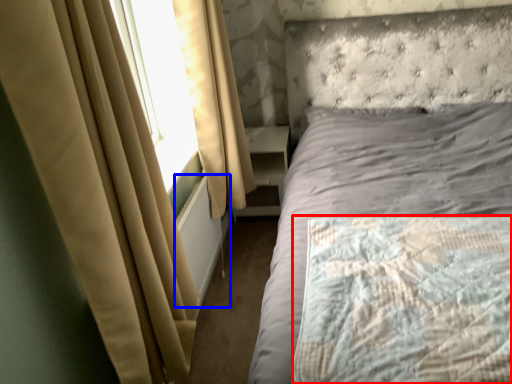
Question: Which of the following is the farthest to the observer, mattress (highlighted by a red box) or radiator (highlighted by a blue box)?

Choices:
 (A) mattress
 (B) radiator

Answer: (B)